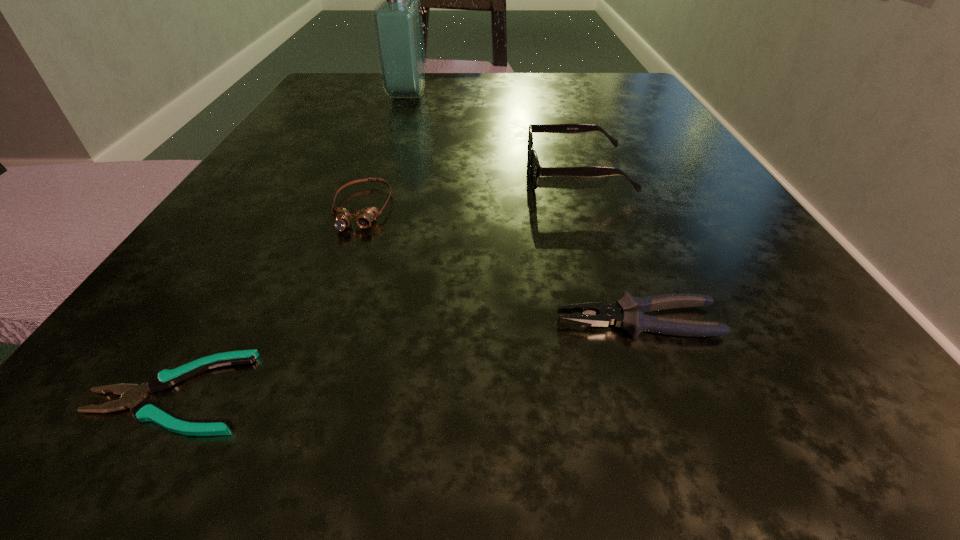
Where is `vacant space at the near left corner`? vacant space at the near left corner is located at coordinates (182, 414).

In the image, there is a desktop. At what (x,y) coordinates should I click in order to perform the action: click on vacant space at the far right corner. Please return your answer as a coordinate pair (x, y). The height and width of the screenshot is (540, 960). Looking at the image, I should click on (582, 97).

Where is `free space between the right pliers and the second tallest object`? free space between the right pliers and the second tallest object is located at coordinates (608, 247).

Identify the location of free space that is in between the left pliers and the fourth shortest object. (375, 283).

Identify the location of free space between the perfume and the right pliers. The height and width of the screenshot is (540, 960). (522, 208).

Identify the location of empty space between the sunglasses and the perfume. (492, 134).

This screenshot has width=960, height=540. What are the coordinates of `empty location between the farthest object and the goggles` in the screenshot? It's located at (384, 152).

Find the location of `unoccupied area between the left pliers and the sunglasses`. unoccupied area between the left pliers and the sunglasses is located at coordinates (375, 283).

Locate an element on the screen. vacant area that lies between the perfume and the nearest object is located at coordinates (290, 244).

Locate an element on the screen. free spot between the shorter pliers and the sunglasses is located at coordinates (375, 283).